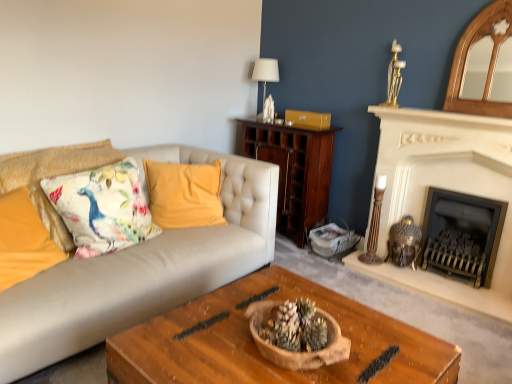
Where is `free space in front of white stone fireplace at right, positioned as the 1th fireplace in left-to-right order`? free space in front of white stone fireplace at right, positioned as the 1th fireplace in left-to-right order is located at coordinates (454, 284).